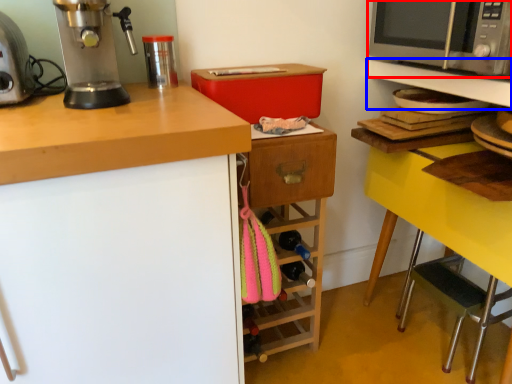
Question: Which object appears closest to the camera in this image, microwave oven (highlighted by a red box) or shelf (highlighted by a blue box)?

Choices:
 (A) microwave oven
 (B) shelf

Answer: (A)